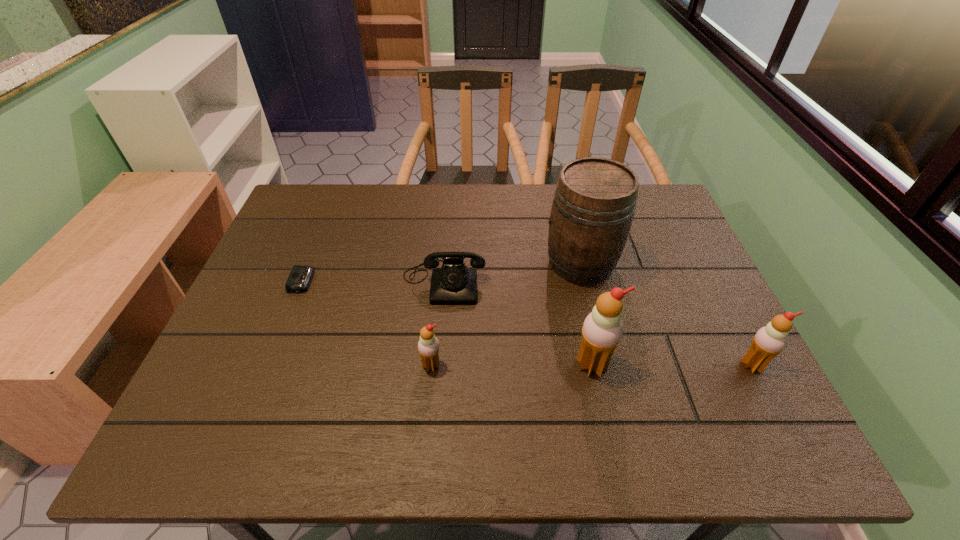
Locate an element on the screen. vacant space at the near edge of the desktop is located at coordinates (354, 394).

Find the location of a particular element. This screenshot has height=540, width=960. blank area at the left edge is located at coordinates (276, 304).

Locate an element on the screen. The width and height of the screenshot is (960, 540). vacant space at the right edge of the desktop is located at coordinates (672, 262).

Identify the location of free space at the far left corner of the desktop. (300, 195).

At what (x,y) coordinates should I click in order to perform the action: click on vacant area that lies between the cider and the second icecream from left to right. Please return your answer as a coordinate pair (x, y). The width and height of the screenshot is (960, 540). Looking at the image, I should click on (587, 314).

Where is `empty space that is in between the shortest object and the fifth tallest object`? empty space that is in between the shortest object and the fifth tallest object is located at coordinates (372, 281).

The height and width of the screenshot is (540, 960). Find the location of `vacant region between the leftmost object and the fourth tallest object`. vacant region between the leftmost object and the fourth tallest object is located at coordinates (367, 323).

Image resolution: width=960 pixels, height=540 pixels. I want to click on vacant space that's between the fifth tallest object and the cider, so click(x=513, y=272).

Locate an element on the screen. The image size is (960, 540). free space between the fourth tallest object and the alarm clock is located at coordinates (367, 323).

Where is `free space that is in between the tallest icecream and the alarm clock`? free space that is in between the tallest icecream and the alarm clock is located at coordinates (446, 323).